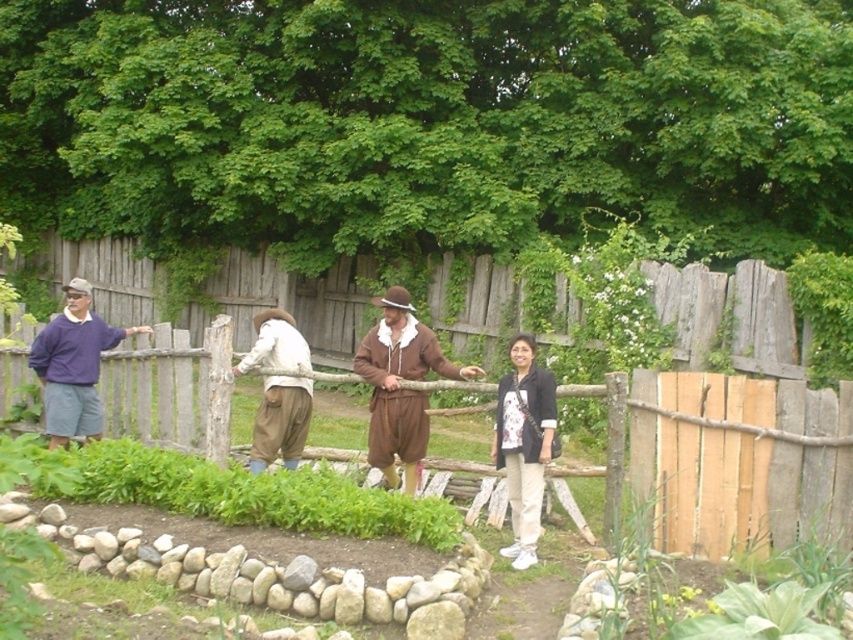
Is brown suede outfit at center wider than white cotton pants at center?

Yes, brown suede outfit at center is wider than white cotton pants at center.

Does point (421, 376) come closer to viewer compared to point (515, 467)?

That is False.

Find the location of a particular element. The image size is (853, 640). brown suede outfit at center is located at coordinates (398, 385).

Locate an element on the screen. The image size is (853, 640). brown suede outfit at center is located at coordinates (398, 385).

Is brown suede outfit at center bigger than purple sweater at left?

Correct, brown suede outfit at center is larger in size than purple sweater at left.

Measure the distance between brown suede outfit at center and camera.

A distance of 22.47 feet exists between brown suede outfit at center and camera.

Does point (419, 358) lie behind point (39, 353)?

That is False.

This screenshot has height=640, width=853. I want to click on brown suede outfit at center, so click(398, 385).

Find the location of a particular element. brown suede outfit at center is located at coordinates (398, 385).

Can you confirm if brown suede outfit at center is positioned above white cotton shirt at center?

Incorrect, brown suede outfit at center is not positioned above white cotton shirt at center.

In the scene shown: Who is more forward, (x=386, y=426) or (x=273, y=346)?

Point (x=386, y=426)

Find the location of a particular element. This screenshot has width=853, height=640. brown suede outfit at center is located at coordinates (398, 385).